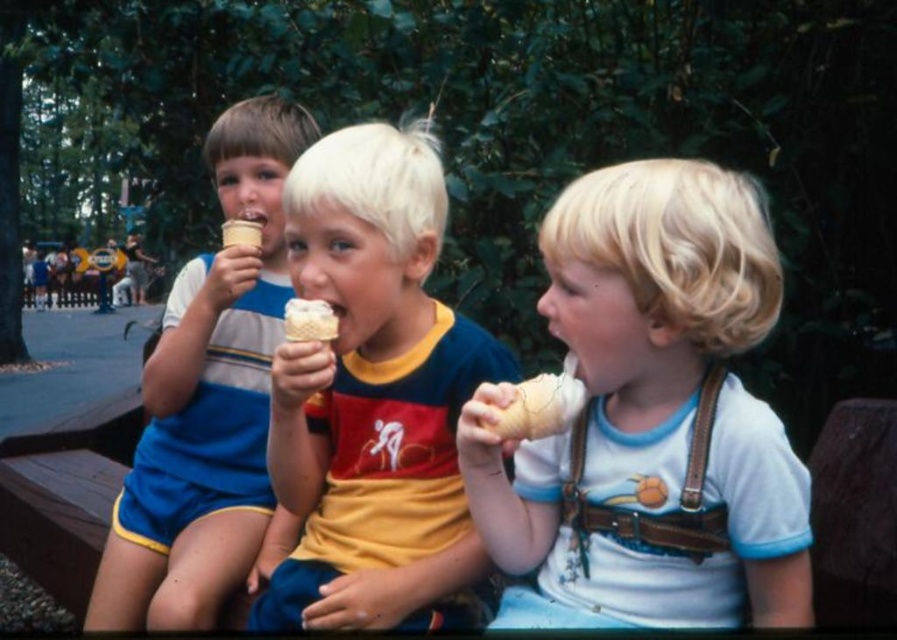
Based on the photo, looking at the scene of three children eating ice cream, which object is positioned to the right of the other between the white matte ice cream cone at center and the matte blue shorts at left?

The white matte ice cream cone at center is to the right of the matte blue shorts at left.

You are a photographer trying to capture a candid shot of the children eating their ice cream. Your camera has a focus range of 25 centimeters. Can you focus on both the white matte ice cream cone at center and the yellow cotton shirt at center in the same shot?

The white matte ice cream cone at center and yellow cotton shirt at center are 25.92 centimeters apart. Since your camera can only focus within 25 centimeters, they are slightly too far apart to be in focus simultaneously.